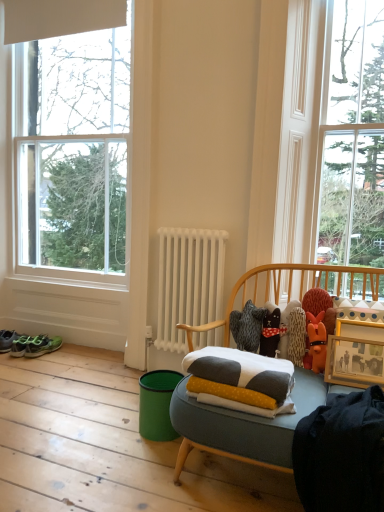
Question: From a real-world perspective, relative to green matte running shoe at lower left, is wooden picture frame at right vertically above or below?

Choices:
 (A) above
 (B) below

Answer: (A)

Question: Is wooden picture frame at right taller or shorter than green matte running shoe at lower left?

Choices:
 (A) tall
 (B) short

Answer: (A)

Question: Which of these objects is positioned farthest from the teal fabric at lower center?

Choices:
 (A) wooden picture frame at right
 (B) clear glass window at upper right, the second window in the left-to-right sequence
 (C) knitted plush bear at center
 (D) white metal radiator at center
 (E) green matte running shoe at lower left

Answer: (B)

Question: Which object is positioned closest to the white metal radiator at center?

Choices:
 (A) soft cotton pillow at center
 (B) teal fabric at lower center
 (C) knitted plush bear at center
 (D) green matte running shoe at lower left
 (E) green fabric sneakers at lower left

Answer: (C)